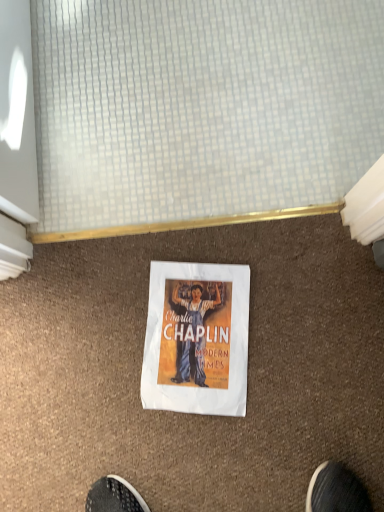
Measure the distance between point (227, 336) and camera.

A distance of 34.06 inches exists between point (227, 336) and camera.

Describe the element at coordinates (197, 339) in the screenshot. The height and width of the screenshot is (512, 384). I see `matte paper poster at center` at that location.

This screenshot has width=384, height=512. What are the coordinates of `matte paper poster at center` in the screenshot? It's located at (197, 339).

I want to click on matte paper poster at center, so click(197, 339).